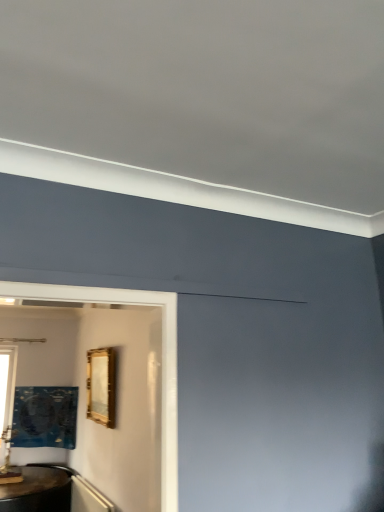
Describe the element at coordinates (7, 385) in the screenshot. I see `clear glass window at left` at that location.

The image size is (384, 512). Find the location of `clear glass window at left`. clear glass window at left is located at coordinates (7, 385).

In the scene shown: Which object is more forward, metallic gold picture frame at lower left, the 1th picture frame from the bottom, or gold metallic picture frame at center, acting as the first picture frame starting from the right?

Positioned in front is gold metallic picture frame at center, acting as the first picture frame starting from the right.

From the picture: How many degrees apart are the facing directions of metallic gold picture frame at lower left, which appears as the 1th picture frame when viewed from the back, and gold metallic picture frame at center, which ranks as the 1th picture frame in top-to-bottom order?

metallic gold picture frame at lower left, which appears as the 1th picture frame when viewed from the back, and gold metallic picture frame at center, which ranks as the 1th picture frame in top-to-bottom order, are facing 89.9 degrees away from each other.

From a real-world perspective, does metallic gold picture frame at lower left, the 1th picture frame from the bottom, sit lower than gold metallic picture frame at center, the first picture frame positioned from the front?

Indeed, from a real-world perspective, metallic gold picture frame at lower left, the 1th picture frame from the bottom, is positioned beneath gold metallic picture frame at center, the first picture frame positioned from the front.

Is metallic gold picture frame at lower left, positioned as the second picture frame in right-to-left order, outside of gold metallic picture frame at center, the first picture frame positioned from the front?

Indeed, metallic gold picture frame at lower left, positioned as the second picture frame in right-to-left order, is completely outside gold metallic picture frame at center, the first picture frame positioned from the front.

Are clear glass window at left and metallic gold picture frame at lower left, which is the 2th picture frame in top-to-bottom order, located far from each other?

No, there isn't a large distance between clear glass window at left and metallic gold picture frame at lower left, which is the 2th picture frame in top-to-bottom order.

Find the location of `window above the metallic gold picture frame at lower left, positioned as the second picture frame in right-to-left order (from a real-world perspective)`. window above the metallic gold picture frame at lower left, positioned as the second picture frame in right-to-left order (from a real-world perspective) is located at coordinates (7, 385).

In the scene shown: Between clear glass window at left and metallic gold picture frame at lower left, the 1th picture frame in the left-to-right sequence, which one has smaller width?

With smaller width is clear glass window at left.

Is clear glass window at left located outside metallic gold picture frame at lower left, which is the 2th picture frame in top-to-bottom order?

clear glass window at left lies outside metallic gold picture frame at lower left, which is the 2th picture frame in top-to-bottom order,'s area.

Does metallic gold picture frame at lower left, the 1th picture frame from the bottom, have a greater height compared to clear glass window at left?

No.

Does metallic gold picture frame at lower left, the 1th picture frame in the left-to-right sequence, appear on the left side of clear glass window at left?

No, metallic gold picture frame at lower left, the 1th picture frame in the left-to-right sequence, is not to the left of clear glass window at left.

Between metallic gold picture frame at lower left, the 1th picture frame from the bottom, and clear glass window at left, which one has smaller width?

clear glass window at left is thinner.

Is the position of metallic gold picture frame at lower left, which is the 2th picture frame in top-to-bottom order, less distant than that of clear glass window at left?

Yes, it is in front of clear glass window at left.

From a real-world perspective, is gold metallic picture frame at center, acting as the first picture frame starting from the right, above or below metallic gold picture frame at lower left, which appears as the 1th picture frame when viewed from the back?

In terms of real-world spatial position, gold metallic picture frame at center, acting as the first picture frame starting from the right, is above metallic gold picture frame at lower left, which appears as the 1th picture frame when viewed from the back.

Is gold metallic picture frame at center, placed as the 2th picture frame when sorted from back to front, positioned in front of metallic gold picture frame at lower left, positioned as the second picture frame in right-to-left order?

Yes.

Would you consider gold metallic picture frame at center, which ranks as the 1th picture frame in top-to-bottom order, to be distant from metallic gold picture frame at lower left, the 1th picture frame from the bottom?

That's right, there is a large distance between gold metallic picture frame at center, which ranks as the 1th picture frame in top-to-bottom order, and metallic gold picture frame at lower left, the 1th picture frame from the bottom.

Is clear glass window at left wider than gold metallic picture frame at center, acting as the first picture frame starting from the right?

Incorrect, the width of clear glass window at left does not surpass that of gold metallic picture frame at center, acting as the first picture frame starting from the right.

What's the angular difference between clear glass window at left and gold metallic picture frame at center, placed as the 2th picture frame when sorted from back to front,'s facing directions?

The angle between the facing direction of clear glass window at left and the facing direction of gold metallic picture frame at center, placed as the 2th picture frame when sorted from back to front, is 87.3 degrees.

The width and height of the screenshot is (384, 512). Find the location of `picture frame lying above the clear glass window at left (from the image's perspective)`. picture frame lying above the clear glass window at left (from the image's perspective) is located at coordinates (101, 386).

From the image's perspective, which object appears higher, clear glass window at left or gold metallic picture frame at center, the first picture frame positioned from the front?

gold metallic picture frame at center, the first picture frame positioned from the front, from the image's perspective.

Is gold metallic picture frame at center, the second picture frame in the bottom-to-top sequence, thinner than clear glass window at left?

In fact, gold metallic picture frame at center, the second picture frame in the bottom-to-top sequence, might be wider than clear glass window at left.

From a real-world perspective, is gold metallic picture frame at center, the first picture frame positioned from the front, physically located above or below clear glass window at left?

From a real-world perspective, gold metallic picture frame at center, the first picture frame positioned from the front, is physically above clear glass window at left.

From the picture: Is gold metallic picture frame at center, placed as the 2th picture frame when sorted from back to front, shorter than clear glass window at left?

Yes, gold metallic picture frame at center, placed as the 2th picture frame when sorted from back to front, is shorter than clear glass window at left.

Is gold metallic picture frame at center, the second picture frame in the bottom-to-top sequence, completely or partially outside of clear glass window at left?

Absolutely, gold metallic picture frame at center, the second picture frame in the bottom-to-top sequence, is external to clear glass window at left.

At what (x,y) coordinates should I click in order to perform the action: click on picture frame above the metallic gold picture frame at lower left, which appears as the 1th picture frame when viewed from the back (from a real-world perspective). Please return your answer as a coordinate pair (x, y). The image size is (384, 512). Looking at the image, I should click on (101, 386).

The width and height of the screenshot is (384, 512). In order to click on window lying above the metallic gold picture frame at lower left, the 1th picture frame from the bottom (from the image's perspective) in this screenshot , I will do `click(7, 385)`.

Estimate the real-world distances between objects in this image. Which object is closer to metallic gold picture frame at lower left, the 2th picture frame in the front-to-back sequence, gold metallic picture frame at center, the first picture frame positioned from the front, or clear glass window at left?

The object closer to metallic gold picture frame at lower left, the 2th picture frame in the front-to-back sequence, is clear glass window at left.

Looking at the image, which one is located closer to clear glass window at left, metallic gold picture frame at lower left, the 2th picture frame in the front-to-back sequence, or gold metallic picture frame at center, the first picture frame positioned from the front?

Based on the image, metallic gold picture frame at lower left, the 2th picture frame in the front-to-back sequence, appears to be nearer to clear glass window at left.

When comparing their distances from gold metallic picture frame at center, which appears as the 2th picture frame when viewed from the left, does metallic gold picture frame at lower left, which appears as the 1th picture frame when viewed from the back, or clear glass window at left seem further?

clear glass window at left lies further to gold metallic picture frame at center, which appears as the 2th picture frame when viewed from the left, than the other object.

Based on their spatial positions, is clear glass window at left or metallic gold picture frame at lower left, the 1th picture frame from the bottom, further from gold metallic picture frame at center, acting as the first picture frame starting from the right?

The object further to gold metallic picture frame at center, acting as the first picture frame starting from the right, is clear glass window at left.

Estimate the real-world distances between objects in this image. Which object is further from metallic gold picture frame at lower left, positioned as the second picture frame in right-to-left order, clear glass window at left or gold metallic picture frame at center, the first picture frame positioned from the front?

The object further to metallic gold picture frame at lower left, positioned as the second picture frame in right-to-left order, is gold metallic picture frame at center, the first picture frame positioned from the front.

Looking at the image, which one is located closer to clear glass window at left, gold metallic picture frame at center, the first picture frame positioned from the front, or metallic gold picture frame at lower left, the 1th picture frame in the left-to-right sequence?

metallic gold picture frame at lower left, the 1th picture frame in the left-to-right sequence, is positioned closer to the anchor clear glass window at left.

Identify the location of picture frame situated between clear glass window at left and gold metallic picture frame at center, the second picture frame in the bottom-to-top sequence, from left to right. This screenshot has width=384, height=512. (45, 417).